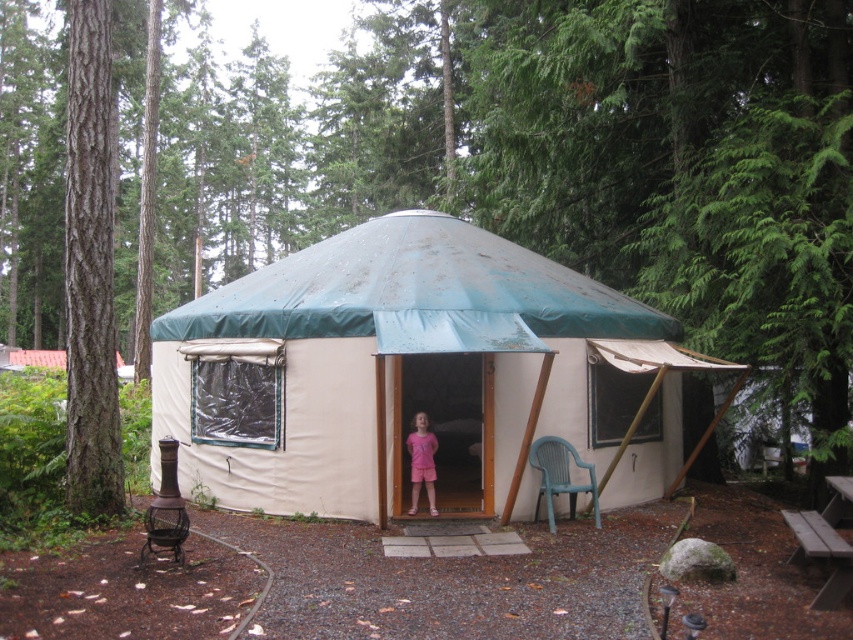
In the scene shown: Does teal fabric canopy at center have a greater height compared to pink fabric dress at center?

Indeed, teal fabric canopy at center has a greater height compared to pink fabric dress at center.

Is teal fabric canopy at center wider than pink fabric dress at center?

Yes.

Identify the location of teal fabric canopy at center. This screenshot has width=853, height=640. (416, 294).

In order to click on teal fabric canopy at center in this screenshot , I will do `click(416, 294)`.

Looking at this image, measure the distance between wooden picnic table at lower right and camera.

They are 19.39 feet apart.

Does point (837, 540) come behind point (543, 436)?

No, (837, 540) is closer to viewer.

Measure the distance between point [817,554] and camera.

A distance of 5.96 meters exists between point [817,554] and camera.

Find the location of `wooden picnic table at lower right`. wooden picnic table at lower right is located at coordinates (825, 540).

This screenshot has width=853, height=640. What do you see at coordinates (416, 294) in the screenshot?
I see `teal fabric canopy at center` at bounding box center [416, 294].

Does teal fabric canopy at center have a lesser height compared to smooth brown bark at left?

Yes, teal fabric canopy at center is shorter than smooth brown bark at left.

The image size is (853, 640). I want to click on teal fabric canopy at center, so click(416, 294).